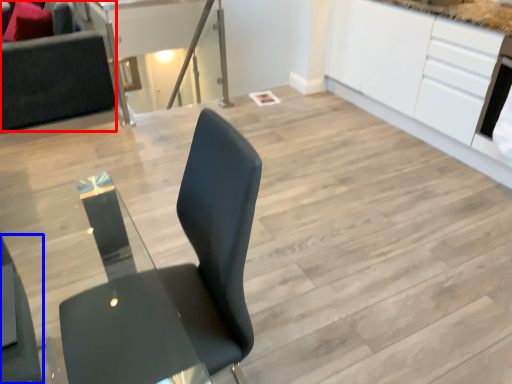
Question: Which object appears closest to the camera in this image, couch (highlighted by a red box) or chair (highlighted by a blue box)?

Choices:
 (A) couch
 (B) chair

Answer: (B)